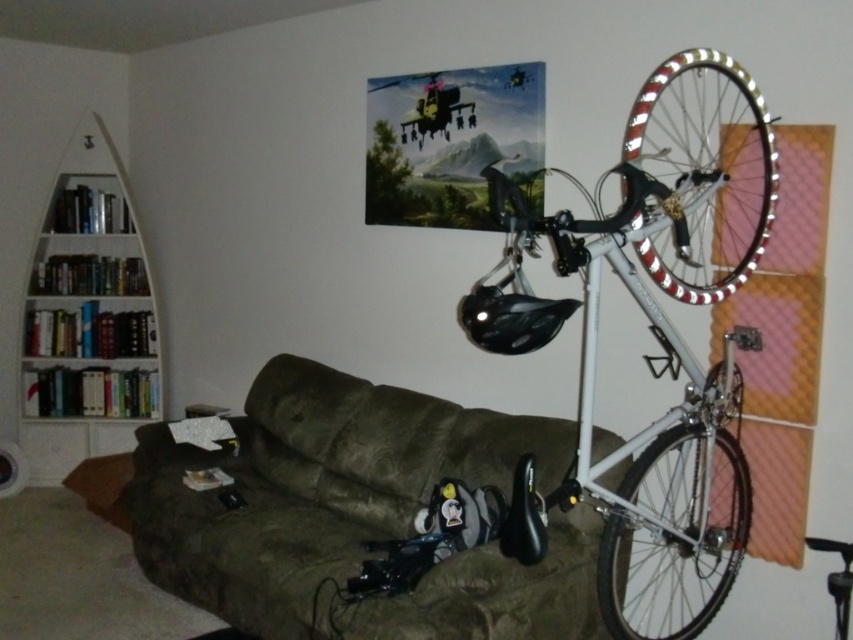
In the scene shown: You are planning to move a new rectangular side table into this living room. The table is 1.2 meters wide. You want to place it between the brown suede couch at lower center and the white metallic bicycle wheel at right. Can the table fit in that space?

The brown suede couch at lower center is wider than the white metallic bicycle wheel at right. However, the exact distance between them isn t specified in the provided information. To determine if the table will fit, you need to measure the space between the two objects. If the gap is at least 1.2 meters wide, the table should fit.

You are trying to rearrange the furniture in the living room. You need to place a new small side table between the brown suede couch at lower center and the white metallic bicycle wheel at right. Based on their sizes, will the side table fit comfortably between them?

The brown suede couch at lower center is larger in size than the white metallic bicycle wheel at right. Since the couch is larger, there might be enough space between them to place a small side table comfortably.